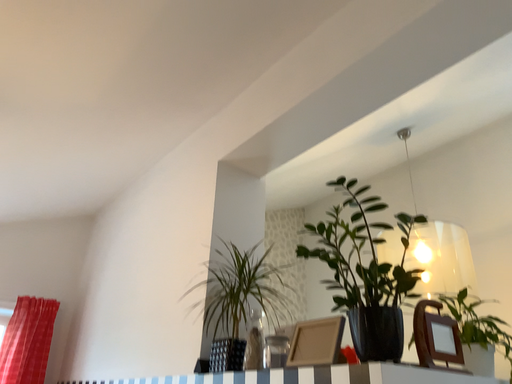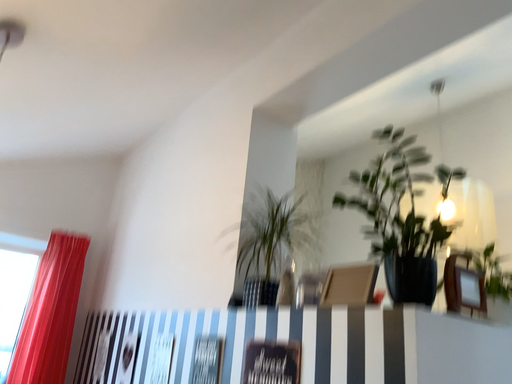
Question: How did the camera likely rotate when shooting the video?

Choices:
 (A) rotated downward
 (B) rotated upward

Answer: (A)